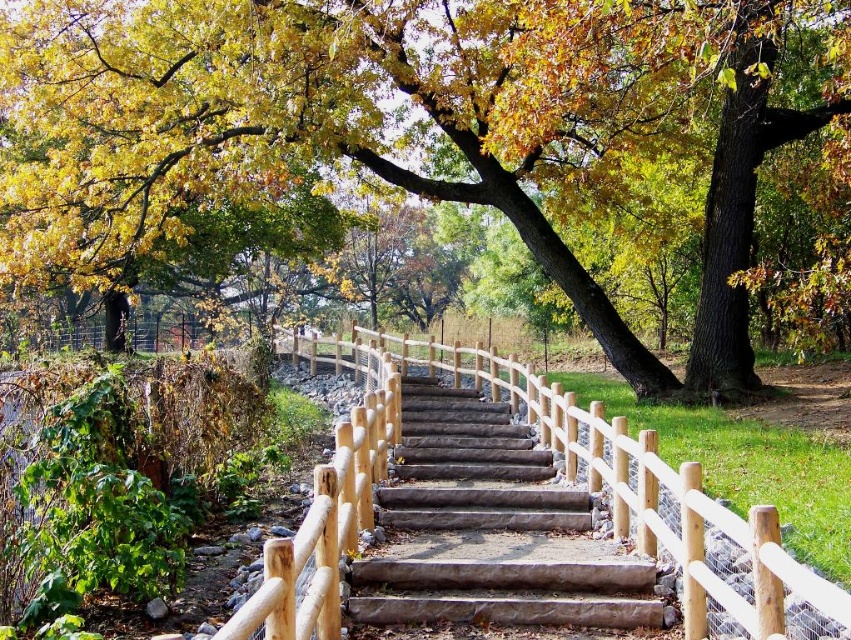
Question: Which of the following is the farthest from the observer?

Choices:
 (A) tap(398, 468)
 (B) tap(343, 442)

Answer: (A)

Question: Does natural wood rail at center have a greater width compared to brown wood stairs at center?

Choices:
 (A) yes
 (B) no

Answer: (A)

Question: Which of the following is the farthest from the observer?

Choices:
 (A) natural wood rail at center
 (B) brown wood stairs at center

Answer: (B)

Question: Is natural wood rail at center above brown wood stairs at center?

Choices:
 (A) yes
 (B) no

Answer: (A)

Question: Does natural wood rail at center lie in front of brown wood stairs at center?

Choices:
 (A) no
 (B) yes

Answer: (B)